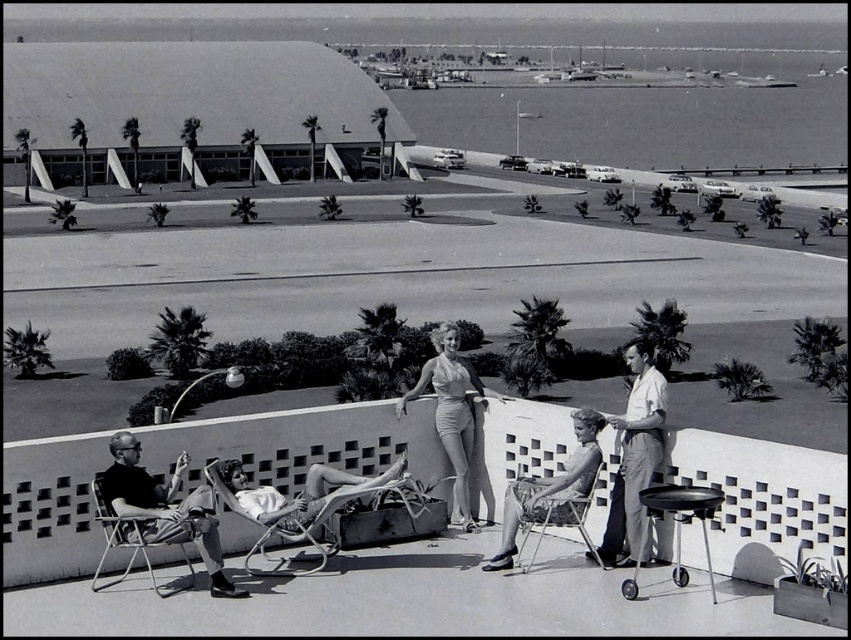
You are a guest at this hotel and want to place a 16 inch wide decorative item between the light gray fabric chair at lower right and the metallic silver chair at lower right. Is there enough space?

The distance between the light gray fabric chair at lower right and the metallic silver chair at lower right is 15.55 inches. Since the decorative item is 16 inches wide, it will not fit in the available space.

You are standing on the rooftop deck and want to move from the dark gray fabric chair at lower left to the metallic silver chair at lower right. Which direction should you move to reach it?

You should move backward because the dark gray fabric chair at lower left is in front of the metallic silver chair at lower right, meaning the metallic silver chair is behind it.

Based on the photo, you are standing at the center of the rooftop deck and see the point at coordinates (634,458). Which object is this point located on?

The point at coordinates (634,458) is located on the light gray fabric chair at lower right.